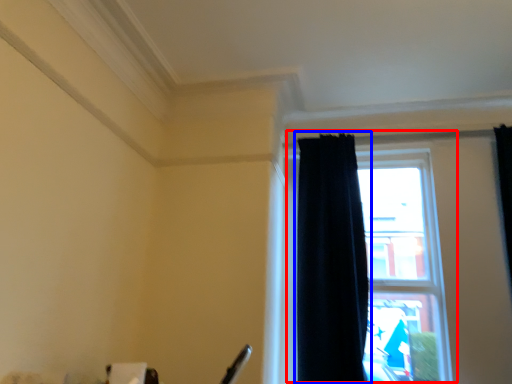
Question: Among these objects, which one is farthest to the camera, window (highlighted by a red box) or curtain (highlighted by a blue box)?

Choices:
 (A) window
 (B) curtain

Answer: (A)